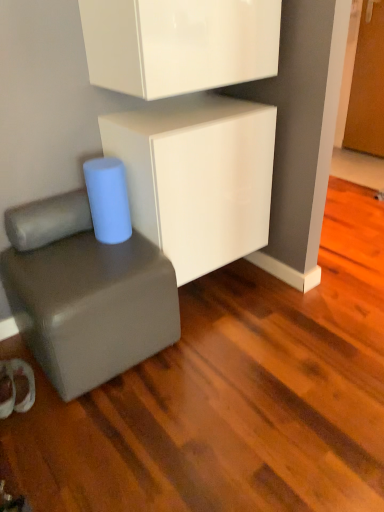
How much space does white glossy cabinet at center, marked as the first cabinetry in a bottom-to-top arrangement, occupy horizontally?

16.74 inches.

This screenshot has width=384, height=512. What do you see at coordinates (197, 178) in the screenshot? I see `white glossy cabinet at center, marked as the first cabinetry in a bottom-to-top arrangement` at bounding box center [197, 178].

Measure the distance between glossy white cabinet at upper center, which is counted as the 2th cabinetry, starting from the bottom, and camera.

The depth of glossy white cabinet at upper center, which is counted as the 2th cabinetry, starting from the bottom, is 1.25 meters.

At what (x,y) coordinates should I click in order to perform the action: click on matte gray cube at lower left. Please return your answer as a coordinate pair (x, y). The width and height of the screenshot is (384, 512). Looking at the image, I should click on (85, 294).

The height and width of the screenshot is (512, 384). Find the location of `white glossy cabinet at center, marked as the first cabinetry in a bottom-to-top arrangement`. white glossy cabinet at center, marked as the first cabinetry in a bottom-to-top arrangement is located at coordinates (197, 178).

Which is in front, point (38, 238) or point (229, 106)?

The point (38, 238) is closer.

Who is more distant, matte gray cube at lower left or white glossy cabinet at center, marked as the first cabinetry in a bottom-to-top arrangement?

white glossy cabinet at center, marked as the first cabinetry in a bottom-to-top arrangement.

Is matte gray cube at lower left wider than white glossy cabinet at center, which appears as the 2th cabinetry when viewed from the top?

Yes.

Is matte gray cube at lower left smaller than white glossy cabinet at center, which appears as the 2th cabinetry when viewed from the top?

Yes, matte gray cube at lower left is smaller than white glossy cabinet at center, which appears as the 2th cabinetry when viewed from the top.

Is matte gray cube at lower left looking in the opposite direction of glossy white cabinet at upper center, the first cabinetry viewed from the top?

No, matte gray cube at lower left is not facing away from glossy white cabinet at upper center, the first cabinetry viewed from the top.

Based on the photo, from a real-world perspective, who is located lower, matte gray cube at lower left or glossy white cabinet at upper center, which is counted as the 2th cabinetry, starting from the bottom?

In real-world perspective, matte gray cube at lower left is lower.

Relative to glossy white cabinet at upper center, the first cabinetry viewed from the top, is matte gray cube at lower left in front or behind?

matte gray cube at lower left is behind glossy white cabinet at upper center, the first cabinetry viewed from the top.

Is matte gray cube at lower left taller or shorter than glossy white cabinet at upper center, the first cabinetry viewed from the top?

matte gray cube at lower left is taller than glossy white cabinet at upper center, the first cabinetry viewed from the top.

Is glossy white cabinet at upper center, which is counted as the 2th cabinetry, starting from the bottom, completely or partially outside of matte gray cube at lower left?

Absolutely, glossy white cabinet at upper center, which is counted as the 2th cabinetry, starting from the bottom, is external to matte gray cube at lower left.

Looking at this image, is glossy white cabinet at upper center, the first cabinetry viewed from the top, in front of or behind matte gray cube at lower left in the image?

glossy white cabinet at upper center, the first cabinetry viewed from the top, is in front of matte gray cube at lower left.

Which point is more forward, (188, 9) or (90, 245)?

The point (188, 9) is in front.

Considering the relative sizes of glossy white cabinet at upper center, the first cabinetry viewed from the top, and matte gray cube at lower left in the image provided, is glossy white cabinet at upper center, the first cabinetry viewed from the top, thinner than matte gray cube at lower left?

Indeed, glossy white cabinet at upper center, the first cabinetry viewed from the top, has a lesser width compared to matte gray cube at lower left.

From the image's perspective, would you say white glossy cabinet at center, marked as the first cabinetry in a bottom-to-top arrangement, is positioned over matte gray cube at lower left?

Correct, white glossy cabinet at center, marked as the first cabinetry in a bottom-to-top arrangement, appears higher than matte gray cube at lower left in the image.

Considering the relative sizes of white glossy cabinet at center, marked as the first cabinetry in a bottom-to-top arrangement, and matte gray cube at lower left in the image provided, is white glossy cabinet at center, marked as the first cabinetry in a bottom-to-top arrangement, taller than matte gray cube at lower left?

Yes.

Considering the positions of objects white glossy cabinet at center, marked as the first cabinetry in a bottom-to-top arrangement, and matte gray cube at lower left in the image provided, who is behind, white glossy cabinet at center, marked as the first cabinetry in a bottom-to-top arrangement, or matte gray cube at lower left?

white glossy cabinet at center, marked as the first cabinetry in a bottom-to-top arrangement, is more distant.

Which object is positioned more to the right, white glossy cabinet at center, marked as the first cabinetry in a bottom-to-top arrangement, or matte gray cube at lower left?

white glossy cabinet at center, marked as the first cabinetry in a bottom-to-top arrangement, is more to the right.

Considering the relative positions of glossy white cabinet at upper center, which is counted as the 2th cabinetry, starting from the bottom, and white glossy cabinet at center, which appears as the 2th cabinetry when viewed from the top, in the image provided, is glossy white cabinet at upper center, which is counted as the 2th cabinetry, starting from the bottom, to the left or to the right of white glossy cabinet at center, which appears as the 2th cabinetry when viewed from the top,?

From the image, it's evident that glossy white cabinet at upper center, which is counted as the 2th cabinetry, starting from the bottom, is to the left of white glossy cabinet at center, which appears as the 2th cabinetry when viewed from the top.

Considering the relative sizes of glossy white cabinet at upper center, which is counted as the 2th cabinetry, starting from the bottom, and white glossy cabinet at center, marked as the first cabinetry in a bottom-to-top arrangement, in the image provided, is glossy white cabinet at upper center, which is counted as the 2th cabinetry, starting from the bottom, bigger than white glossy cabinet at center, marked as the first cabinetry in a bottom-to-top arrangement,?

No, glossy white cabinet at upper center, which is counted as the 2th cabinetry, starting from the bottom, is not bigger than white glossy cabinet at center, marked as the first cabinetry in a bottom-to-top arrangement.

Is glossy white cabinet at upper center, which is counted as the 2th cabinetry, starting from the bottom, oriented towards white glossy cabinet at center, which appears as the 2th cabinetry when viewed from the top?

No, glossy white cabinet at upper center, which is counted as the 2th cabinetry, starting from the bottom, is not oriented towards white glossy cabinet at center, which appears as the 2th cabinetry when viewed from the top.

Where is `cabinetry located below the glossy white cabinet at upper center, which is counted as the 2th cabinetry, starting from the bottom (from the image's perspective)`? cabinetry located below the glossy white cabinet at upper center, which is counted as the 2th cabinetry, starting from the bottom (from the image's perspective) is located at coordinates (197, 178).

Does white glossy cabinet at center, marked as the first cabinetry in a bottom-to-top arrangement, have a smaller size compared to glossy white cabinet at upper center, which is counted as the 2th cabinetry, starting from the bottom?

No, white glossy cabinet at center, marked as the first cabinetry in a bottom-to-top arrangement, is not smaller than glossy white cabinet at upper center, which is counted as the 2th cabinetry, starting from the bottom.

In terms of height, does white glossy cabinet at center, which appears as the 2th cabinetry when viewed from the top, look taller or shorter compared to glossy white cabinet at upper center, the first cabinetry viewed from the top?

Considering their sizes, white glossy cabinet at center, which appears as the 2th cabinetry when viewed from the top, has more height than glossy white cabinet at upper center, the first cabinetry viewed from the top.

Considering the relative sizes of white glossy cabinet at center, marked as the first cabinetry in a bottom-to-top arrangement, and glossy white cabinet at upper center, which is counted as the 2th cabinetry, starting from the bottom, in the image provided, is white glossy cabinet at center, marked as the first cabinetry in a bottom-to-top arrangement, wider than glossy white cabinet at upper center, which is counted as the 2th cabinetry, starting from the bottom,?

Indeed, white glossy cabinet at center, marked as the first cabinetry in a bottom-to-top arrangement, has a greater width compared to glossy white cabinet at upper center, which is counted as the 2th cabinetry, starting from the bottom.

Based on their positions, is white glossy cabinet at center, marked as the first cabinetry in a bottom-to-top arrangement, located to the left or right of glossy white cabinet at upper center, the first cabinetry viewed from the top?

From the image, it's evident that white glossy cabinet at center, marked as the first cabinetry in a bottom-to-top arrangement, is to the right of glossy white cabinet at upper center, the first cabinetry viewed from the top.

From the image's perspective, starting from the matte gray cube at lower left, which cabinetry is the 1st one above? Please provide its 2D coordinates.

[(197, 178)]

Identify the location of furniture behind the glossy white cabinet at upper center, the first cabinetry viewed from the top. (85, 294).

From the image, which object appears to be nearer to glossy white cabinet at upper center, which is counted as the 2th cabinetry, starting from the bottom, matte gray cube at lower left or white glossy cabinet at center, which appears as the 2th cabinetry when viewed from the top?

white glossy cabinet at center, which appears as the 2th cabinetry when viewed from the top, is positioned closer to the anchor glossy white cabinet at upper center, which is counted as the 2th cabinetry, starting from the bottom.

Looking at the image, which one is located further to white glossy cabinet at center, marked as the first cabinetry in a bottom-to-top arrangement, glossy white cabinet at upper center, which is counted as the 2th cabinetry, starting from the bottom, or matte gray cube at lower left?

The object further to white glossy cabinet at center, marked as the first cabinetry in a bottom-to-top arrangement, is matte gray cube at lower left.

From the image, which object appears to be nearer to matte gray cube at lower left, white glossy cabinet at center, which appears as the 2th cabinetry when viewed from the top, or glossy white cabinet at upper center, which is counted as the 2th cabinetry, starting from the bottom?

white glossy cabinet at center, which appears as the 2th cabinetry when viewed from the top, lies closer to matte gray cube at lower left than the other object.

When comparing their distances from matte gray cube at lower left, does glossy white cabinet at upper center, the first cabinetry viewed from the top, or white glossy cabinet at center, which appears as the 2th cabinetry when viewed from the top, seem further?

glossy white cabinet at upper center, the first cabinetry viewed from the top, lies further to matte gray cube at lower left than the other object.

From the image, which object appears to be farther from glossy white cabinet at upper center, which is counted as the 2th cabinetry, starting from the bottom, white glossy cabinet at center, marked as the first cabinetry in a bottom-to-top arrangement, or matte gray cube at lower left?

Based on the image, matte gray cube at lower left appears to be further to glossy white cabinet at upper center, which is counted as the 2th cabinetry, starting from the bottom.

Looking at the image, which one is located further to white glossy cabinet at center, marked as the first cabinetry in a bottom-to-top arrangement, matte gray cube at lower left or glossy white cabinet at upper center, the first cabinetry viewed from the top?

matte gray cube at lower left.

Where is `cabinetry between glossy white cabinet at upper center, which is counted as the 2th cabinetry, starting from the bottom, and matte gray cube at lower left, in the vertical direction`? The height and width of the screenshot is (512, 384). cabinetry between glossy white cabinet at upper center, which is counted as the 2th cabinetry, starting from the bottom, and matte gray cube at lower left, in the vertical direction is located at coordinates (197, 178).